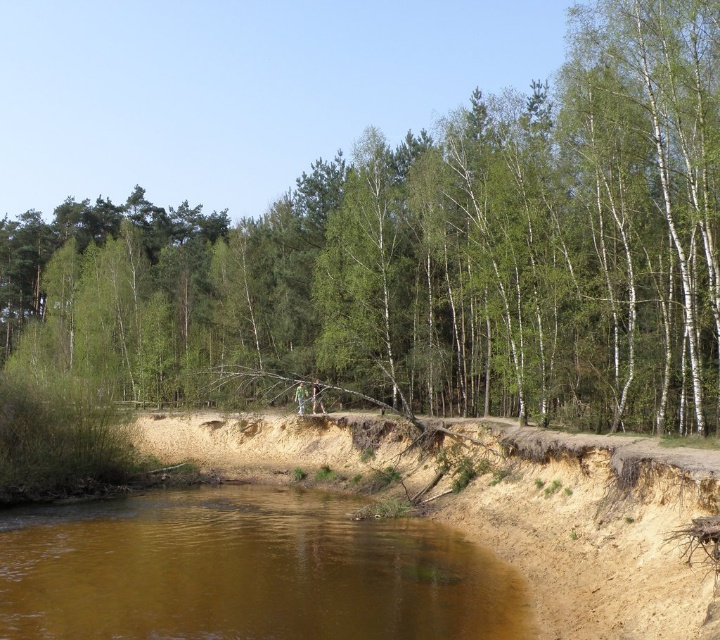
You are standing at the edge of the brown sandy river at lower center and looking towards the green leafy tree at center. Which object is taller?

The green leafy tree at center is much taller than the brown sandy river at lower center.

Based on the photo, you are standing at the edge of the brown sandy river at lower center and want to see the green leafy tree at center. Which direction should you look to see it?

The green leafy tree at center is in front of the brown sandy river at lower center, so you should look forward towards the tree to see it.